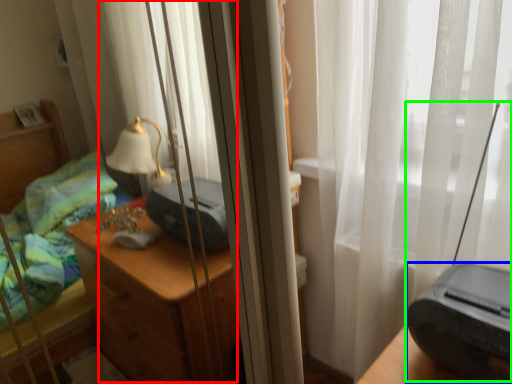
Question: Which object is the farthest from curtain (highlighted by a red box)? Choose among these: printer (highlighted by a blue box) or equipment (highlighted by a green box).

Choices:
 (A) printer
 (B) equipment

Answer: (A)